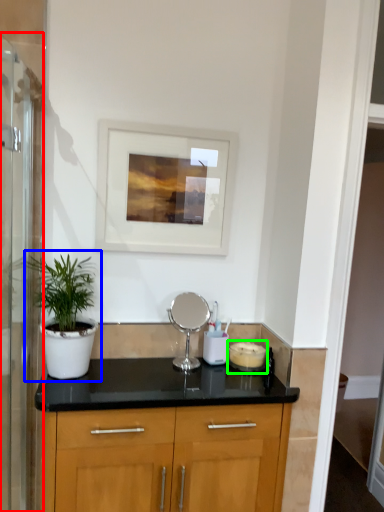
Question: Which is nearer to the screen door (highlighted by a red box)? houseplant (highlighted by a blue box) or appliance (highlighted by a green box).

Choices:
 (A) houseplant
 (B) appliance

Answer: (A)